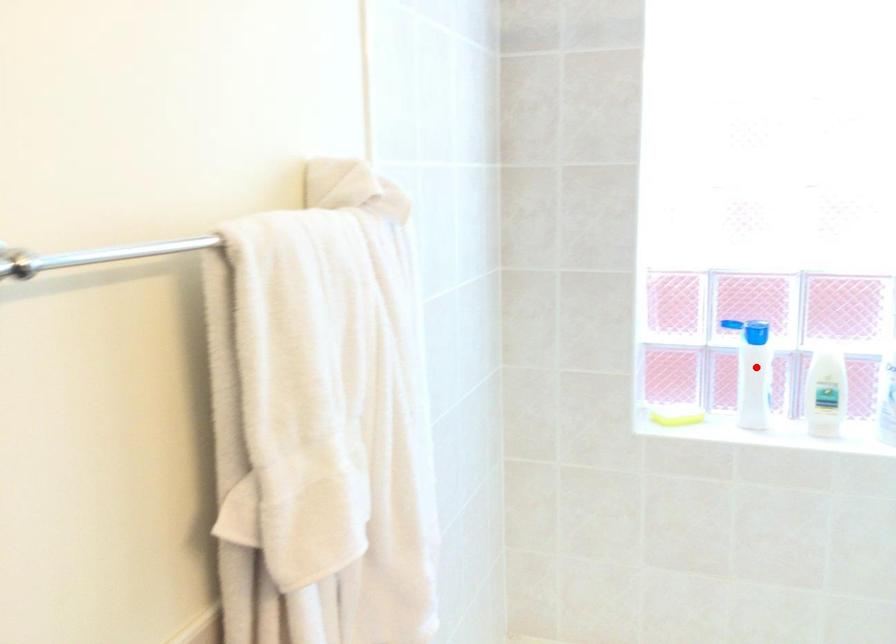
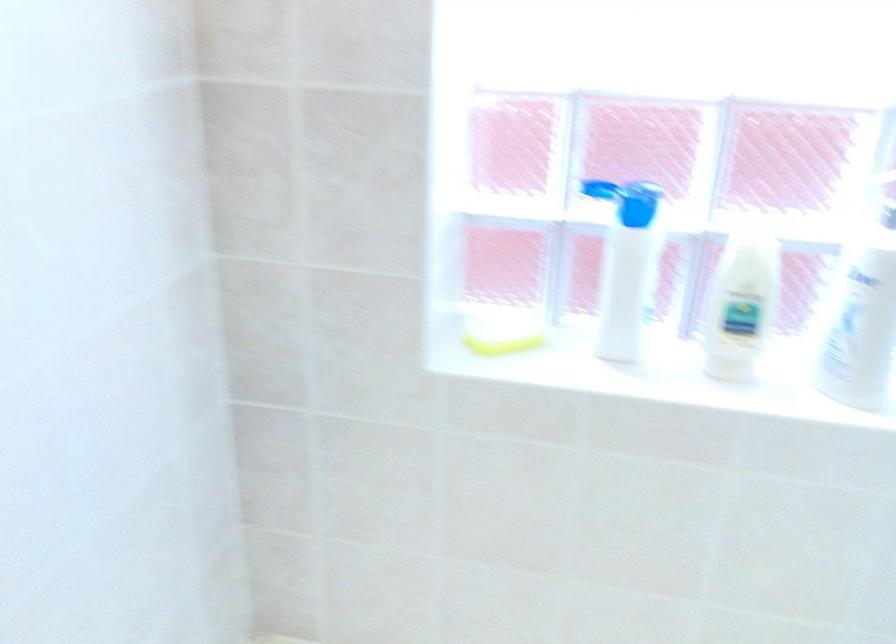
Locate, in the second image, the point that corresponds to the highlighted location in the first image.

(625, 266)